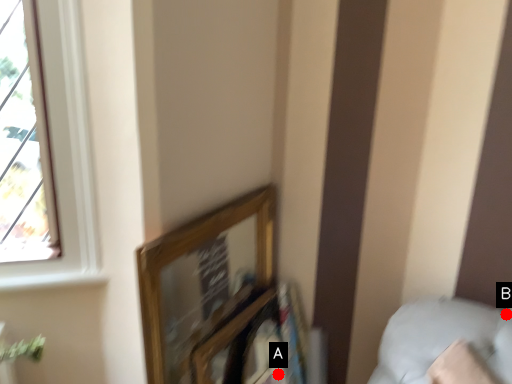
Question: Two points are circled on the image, labeled by A and B beside each circle. Which point is closer to the camera?

Choices:
 (A) A is closer
 (B) B is closer

Answer: (B)